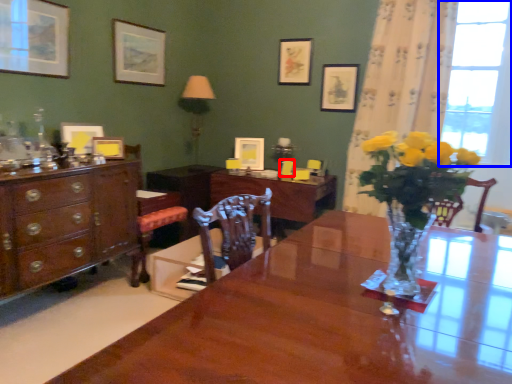
Question: Which object appears closest to the camera in this image, armchair (highlighted by a red box) or window (highlighted by a blue box)?

Choices:
 (A) armchair
 (B) window

Answer: (B)